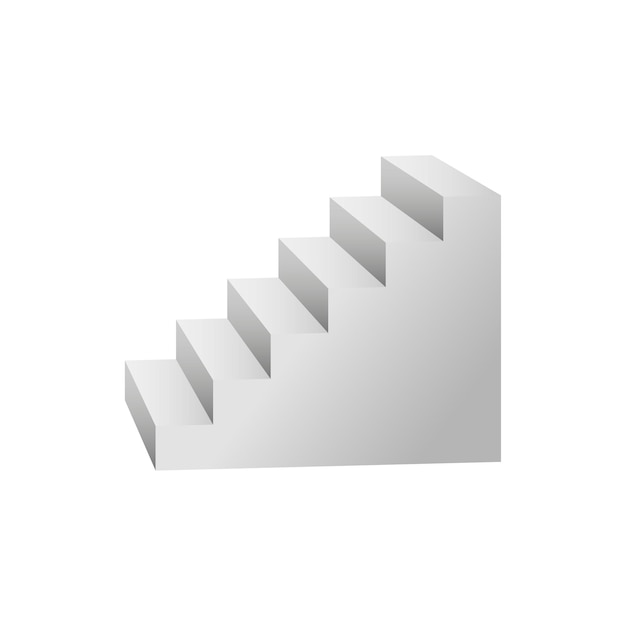
You are a GUI agent. You are given a task and a screenshot of the screen. Output one action in this format:
    pyautogui.click(x=<x>, y=<y>)
    Task: Click on the stairway step tread area
    Image resolution: width=626 pixels, height=626 pixels.
    Given the screenshot: What is the action you would take?
    pyautogui.click(x=163, y=386), pyautogui.click(x=220, y=347), pyautogui.click(x=275, y=309), pyautogui.click(x=332, y=264), pyautogui.click(x=386, y=218), pyautogui.click(x=436, y=173)